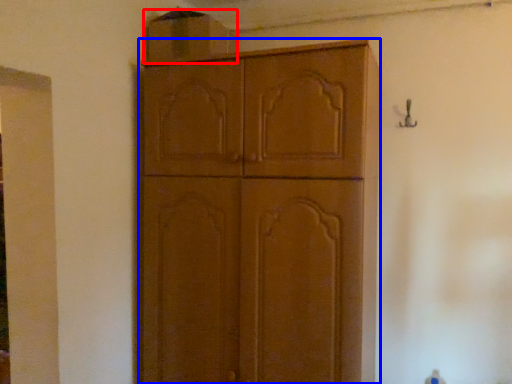
Question: Which of the following is the farthest to the observer, cabinetry (highlighted by a red box) or cabinetry (highlighted by a blue box)?

Choices:
 (A) cabinetry
 (B) cabinetry

Answer: (A)